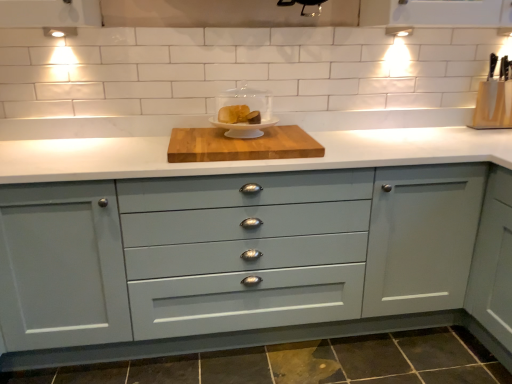
Question: Can you confirm if matte white cake stand at center, which appears as the first appliance when viewed from the front, is smaller than wooden cutting board at center?

Choices:
 (A) yes
 (B) no

Answer: (A)

Question: From a real-world perspective, is matte white cake stand at center, the 2th appliance in the right-to-left sequence, under wooden cutting board at center?

Choices:
 (A) no
 (B) yes

Answer: (A)

Question: From the image's perspective, is matte white cake stand at center, which appears as the 1th appliance when viewed from the left, under wooden cutting board at center?

Choices:
 (A) yes
 (B) no

Answer: (B)

Question: Can you confirm if matte white cake stand at center, the 2th appliance from the back, is taller than wooden cutting board at center?

Choices:
 (A) yes
 (B) no

Answer: (A)

Question: From the image's perspective, would you say matte white cake stand at center, the 2th appliance from the back, is positioned over wooden cutting board at center?

Choices:
 (A) yes
 (B) no

Answer: (A)

Question: From the image's perspective, is matte gray cabinet at center positioned above or below wooden cutting board at center?

Choices:
 (A) above
 (B) below

Answer: (B)

Question: Considering the positions of matte gray cabinet at center and wooden cutting board at center in the image, is matte gray cabinet at center bigger or smaller than wooden cutting board at center?

Choices:
 (A) small
 (B) big

Answer: (B)

Question: Is point (217, 304) positioned closer to the camera than point (192, 155)?

Choices:
 (A) closer
 (B) farther

Answer: (B)

Question: In terms of height, does matte gray cabinet at center look taller or shorter compared to wooden cutting board at center?

Choices:
 (A) tall
 (B) short

Answer: (A)

Question: Visually, is matte white cake stand at center, which appears as the 1th appliance when viewed from the left, positioned to the left or to the right of wooden cutting board at center?

Choices:
 (A) right
 (B) left

Answer: (A)

Question: Looking at the image, does matte white cake stand at center, the 2th appliance in the right-to-left sequence, seem bigger or smaller compared to wooden cutting board at center?

Choices:
 (A) big
 (B) small

Answer: (B)

Question: Would you say matte white cake stand at center, which appears as the 1th appliance when viewed from the left, is inside or outside wooden cutting board at center?

Choices:
 (A) inside
 (B) outside

Answer: (B)

Question: From a real-world perspective, is matte white cake stand at center, the 2th appliance in the right-to-left sequence, positioned above or below wooden cutting board at center?

Choices:
 (A) below
 (B) above

Answer: (B)

Question: In terms of size, does wooden knife block at upper right, positioned as the 2th appliance in left-to-right order, appear bigger or smaller than matte white cake stand at center, which appears as the first appliance when viewed from the front?

Choices:
 (A) big
 (B) small

Answer: (B)

Question: From a real-world perspective, is wooden knife block at upper right, positioned as the 2th appliance in left-to-right order, above or below matte white cake stand at center, which appears as the 1th appliance when viewed from the left?

Choices:
 (A) above
 (B) below

Answer: (A)